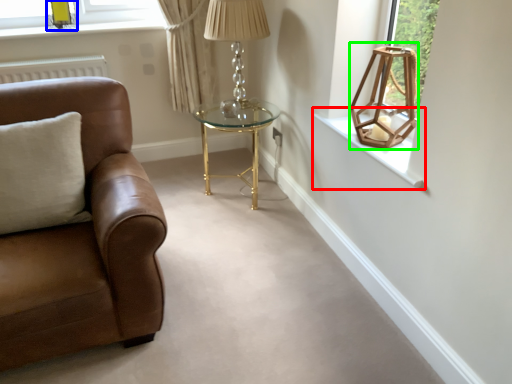
Question: Which object is the farthest from window sill (highlighted by a red box)? Choose among these: lamp (highlighted by a blue box) or lamp (highlighted by a green box).

Choices:
 (A) lamp
 (B) lamp

Answer: (A)